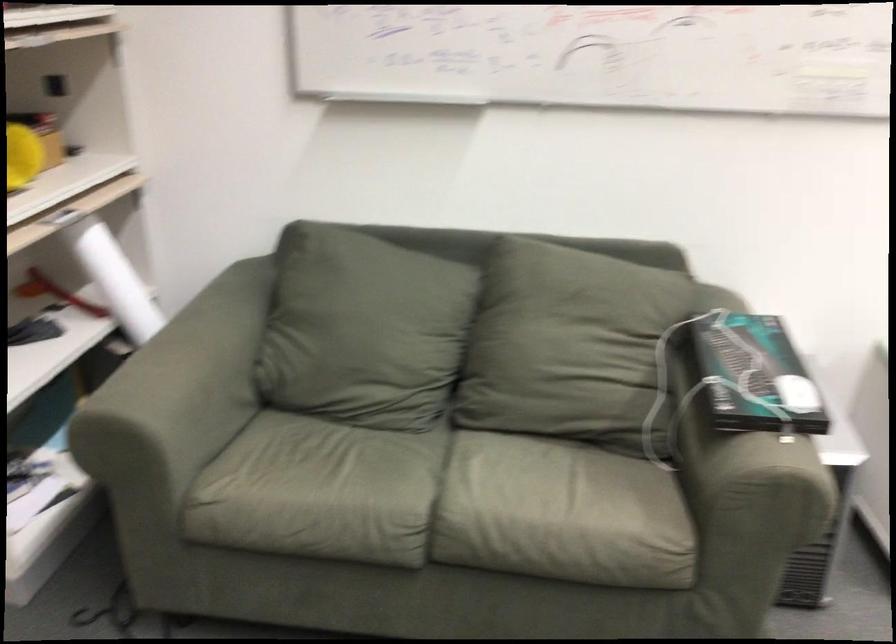
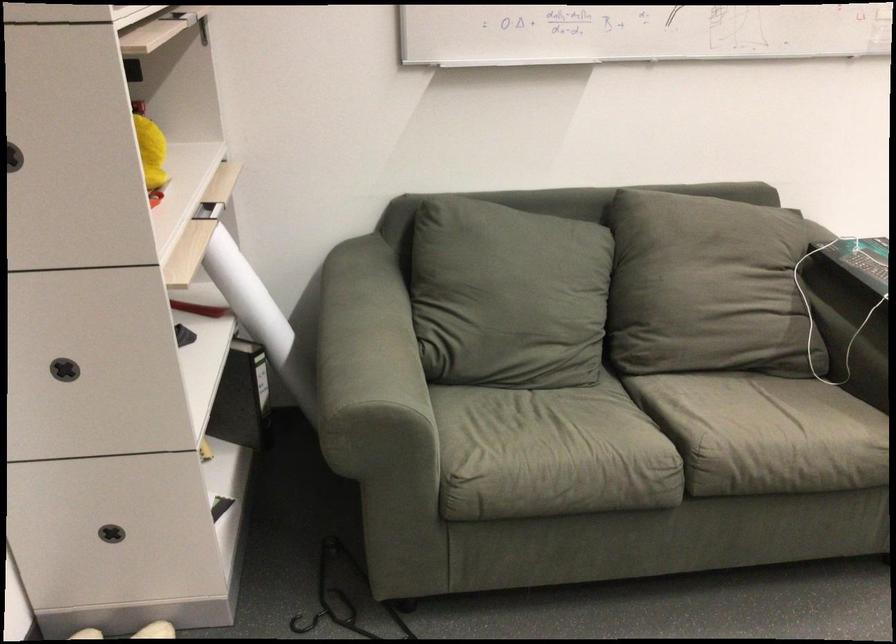
Where in the second image is the point corresponding to pixel 718 339 from the first image?

(860, 259)